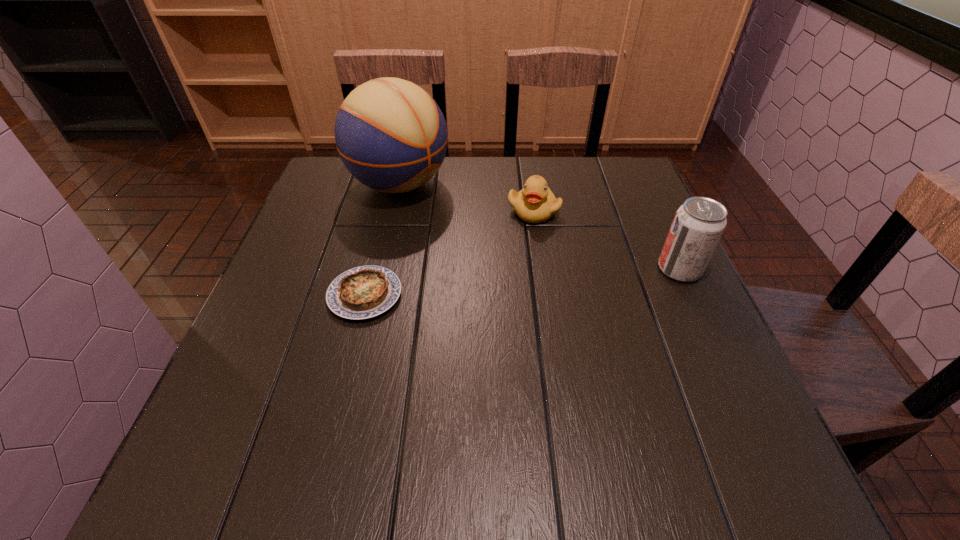
Locate an element on the screen. This screenshot has height=540, width=960. free space at the far edge of the desktop is located at coordinates (502, 201).

You are a GUI agent. You are given a task and a screenshot of the screen. Output one action in this format:
    pyautogui.click(x=<x>, y=<y>)
    Task: Click on the vacant region at the near edge
    The image size is (960, 540).
    Given the screenshot: What is the action you would take?
    pyautogui.click(x=359, y=403)

Identify the location of vacant space at the left edge. The height and width of the screenshot is (540, 960). (282, 259).

This screenshot has width=960, height=540. Identify the location of free location at the far left corner of the desktop. (368, 199).

Identify the location of blank space at the far right corner of the desktop. The height and width of the screenshot is (540, 960). (595, 176).

The height and width of the screenshot is (540, 960). Find the location of `unoccupied position between the third shortest object and the shortest object`. unoccupied position between the third shortest object and the shortest object is located at coordinates (522, 282).

At what (x,y) coordinates should I click in order to perform the action: click on free space that is in between the soda can and the shortest object. Please return your answer as a coordinate pair (x, y). The height and width of the screenshot is (540, 960). Looking at the image, I should click on (522, 282).

This screenshot has width=960, height=540. In order to click on vacant area that lies between the quiche and the duckling in this screenshot , I will do `click(449, 253)`.

At what (x,y) coordinates should I click in order to perform the action: click on vacant region between the shortest object and the duckling. Please return your answer as a coordinate pair (x, y). Image resolution: width=960 pixels, height=540 pixels. Looking at the image, I should click on (449, 253).

Image resolution: width=960 pixels, height=540 pixels. I want to click on free space between the quiche and the basketball, so click(382, 240).